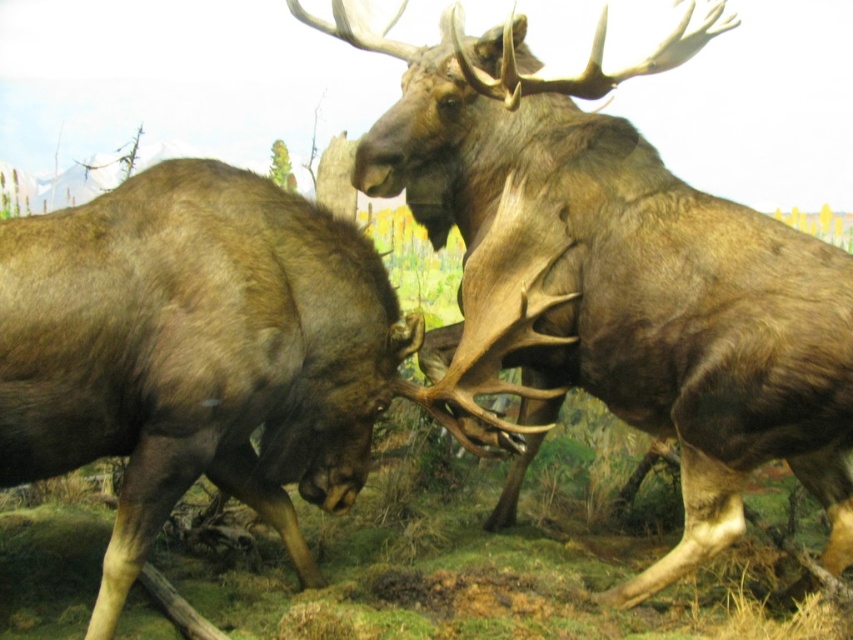
You are a visitor at the museum and see two moose exhibits. The first is a brown furry moose at center and the second is a brown velvet moose at center. Which one is positioned to the right of the other?

The brown furry moose at center is positioned to the right of the brown velvet moose at center.

You are standing at the origin point in the image. Which of the two points, point (485, 205) or point (399, 314), is farther away from you?

Point (485, 205) is farther away from you because it is behind point (399, 314).

You are a wildlife photographer who wants to capture a photo of both the brown furry moose at center and the brown velvet moose at center in the same frame. Based on their heights, which moose should you focus on first to ensure both are in the frame?

The brown furry moose at center is much taller than the brown velvet moose at center. To ensure both are in the frame, focus on the brown furry moose at center first as it occupies more vertical space, then adjust the camera angle to include the shorter brown velvet moose at center.